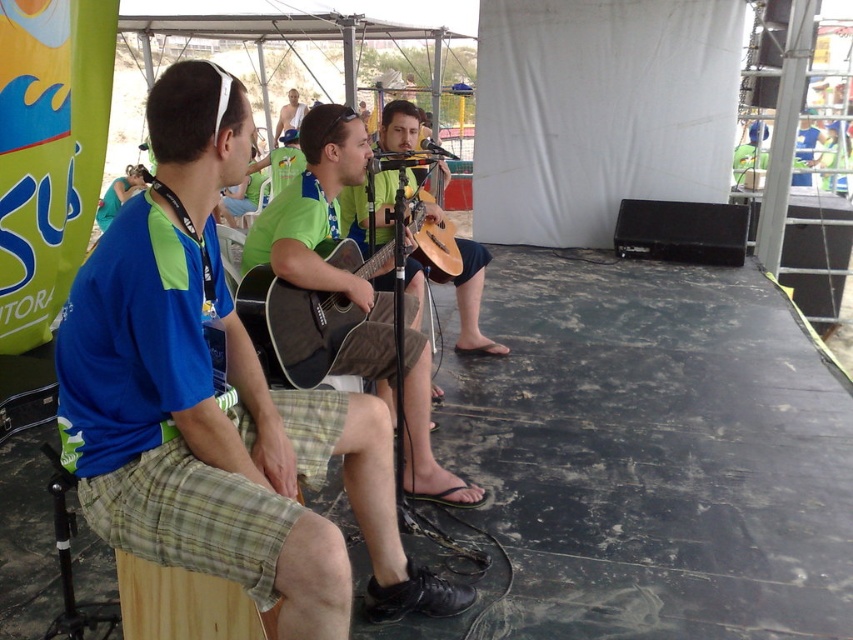
Can you confirm if blue fabric shirt at left is shorter than matte black acoustic guitar at center?

Incorrect, blue fabric shirt at left's height does not fall short of matte black acoustic guitar at center's.

Who is higher up, blue fabric shirt at left or matte black acoustic guitar at center?

matte black acoustic guitar at center

Describe the element at coordinates (216, 401) in the screenshot. The width and height of the screenshot is (853, 640). I see `blue fabric shirt at left` at that location.

Identify the location of blue fabric shirt at left. (216, 401).

Does green fabric shirt at center have a lesser height compared to matte black acoustic guitar at center?

Incorrect, green fabric shirt at center's height does not fall short of matte black acoustic guitar at center's.

Between point (302, 236) and point (300, 307), which one is positioned behind?

Positioned behind is point (300, 307).

This screenshot has width=853, height=640. I want to click on green fabric shirt at center, so click(x=328, y=240).

Can you confirm if blue fabric shirt at left is positioned above green fabric shirt at center?

Incorrect, blue fabric shirt at left is not positioned above green fabric shirt at center.

Can you confirm if blue fabric shirt at left is bigger than green fabric shirt at center?

No, blue fabric shirt at left is not bigger than green fabric shirt at center.

Is point (373, 525) behind point (405, 330)?

No, it is not.

Locate an element on the screen. Image resolution: width=853 pixels, height=640 pixels. blue fabric shirt at left is located at coordinates (216, 401).